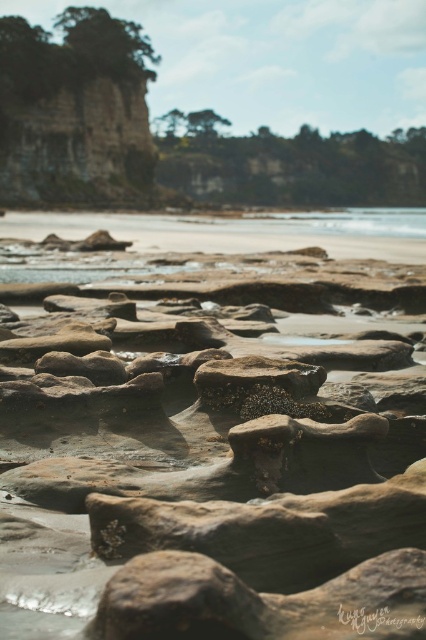
Is smooth sandstone rock at center in front of clear water at center?

That is True.

What do you see at coordinates (212, 449) in the screenshot?
I see `smooth sandstone rock at center` at bounding box center [212, 449].

Image resolution: width=426 pixels, height=640 pixels. What are the coordinates of `smooth sandstone rock at center` in the screenshot? It's located at coord(212,449).